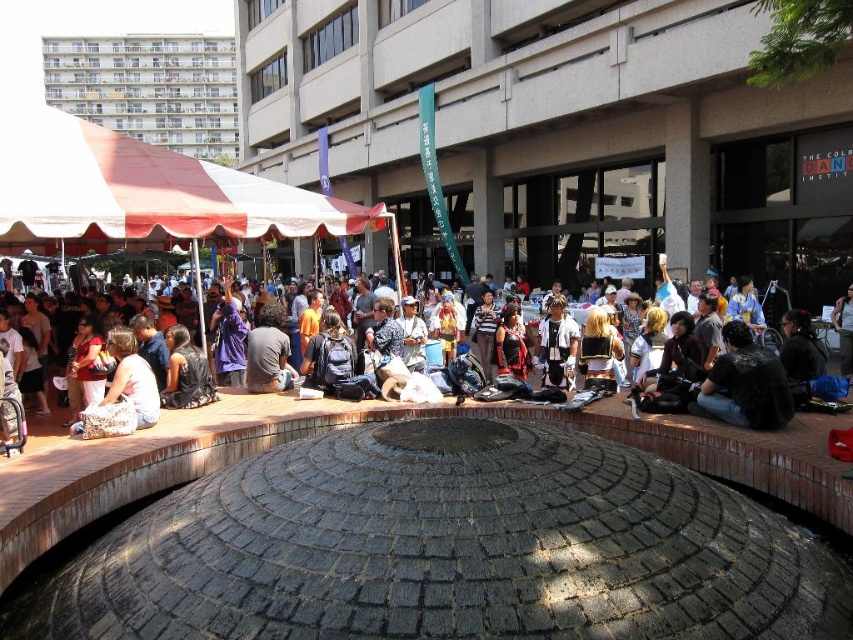
Question: Among these points, which one is farthest from the camera?

Choices:
 (A) (141, 424)
 (B) (119, 177)
 (C) (767, 388)

Answer: (B)

Question: Does dark gray backpack at center have a larger size compared to matte black backpack at center?

Choices:
 (A) no
 (B) yes

Answer: (A)

Question: Which of these objects is positioned closest to the white fabric canopy at upper left?

Choices:
 (A) white fabric bag at center
 (B) dark gray leather jacket at center

Answer: (A)

Question: From the image, what is the correct spatial relationship of dark gray leather jacket at center in relation to white fabric bag at center?

Choices:
 (A) right
 (B) left

Answer: (A)

Question: Which of the following is the farthest from the observer?

Choices:
 (A) dark gray leather jacket at center
 (B) white fabric canopy at upper left
 (C) matte black backpack at center
 (D) white matte jacket at center

Answer: (D)

Question: Can you confirm if white fabric bag at center is positioned below white matte jacket at center?

Choices:
 (A) no
 (B) yes

Answer: (B)